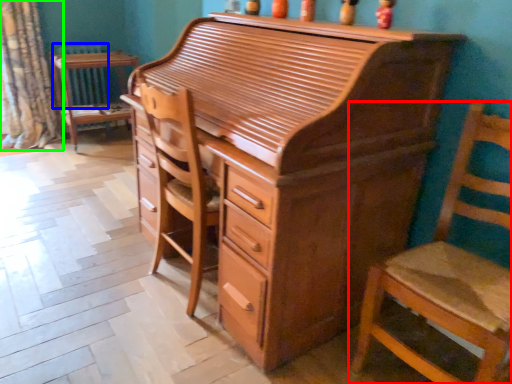
Question: Which object is positioned farthest from chair (highlighted by a red box)? Select from radiator (highlighted by a blue box) and curtain (highlighted by a green box).

Choices:
 (A) radiator
 (B) curtain

Answer: (A)